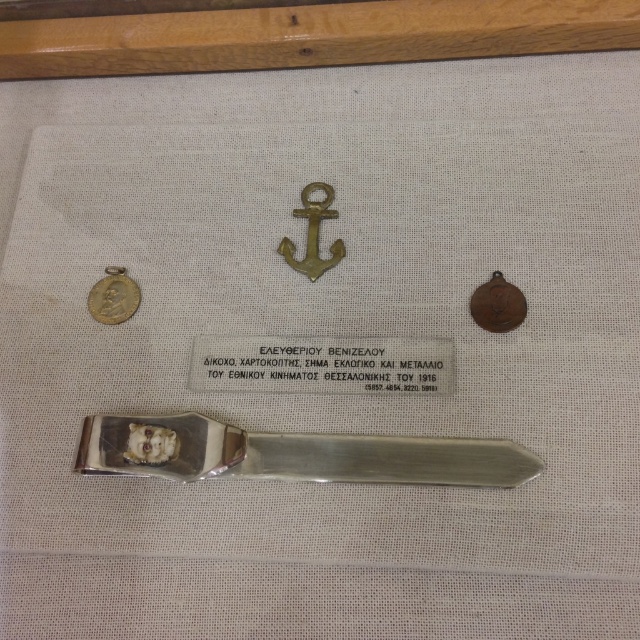
Question: Can you confirm if silver metallic letter opener at center is bigger than gold plated coin at left?

Choices:
 (A) no
 (B) yes

Answer: (B)

Question: Is silver metallic letter opener at center bigger than gold plated coin at left?

Choices:
 (A) no
 (B) yes

Answer: (B)

Question: Which object is farther from the camera taking this photo?

Choices:
 (A) gold plated coin at left
 (B) silver metallic letter opener at center

Answer: (A)

Question: Which of the following is the closest to the observer?

Choices:
 (A) (435, 451)
 (B) (124, 275)

Answer: (A)

Question: Which object appears farthest from the camera in this image?

Choices:
 (A) gold plated coin at left
 (B) silver metallic letter opener at center

Answer: (A)

Question: Does silver metallic letter opener at center have a lesser width compared to gold plated coin at left?

Choices:
 (A) yes
 (B) no

Answer: (B)